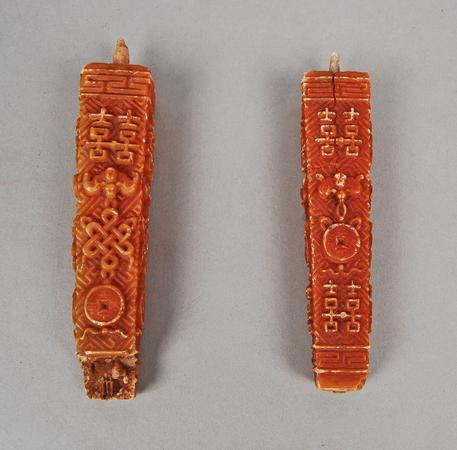
Where is `bottom of candle`? The image size is (457, 450). bottom of candle is located at coordinates (100, 379).